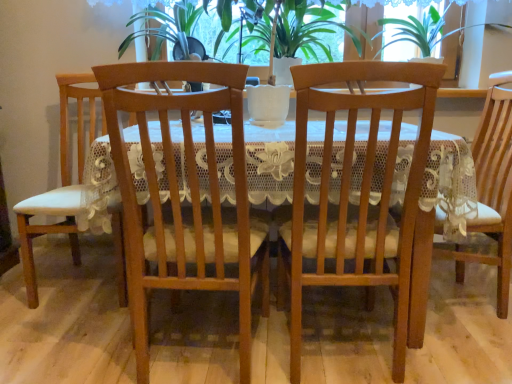
Question: Is white leather chair at left, the 4th chair in the right-to-left sequence, spatially inside wooden table at center, or outside of it?

Choices:
 (A) outside
 (B) inside

Answer: (A)

Question: Is white leather chair at left, the 4th chair in the right-to-left sequence, taller or shorter than wooden table at center?

Choices:
 (A) short
 (B) tall

Answer: (B)

Question: Which object is the farthest from the white leather chair at left, the 4th chair in the right-to-left sequence?

Choices:
 (A) transparent lace at upper center
 (B) wooden table at center
 (C) matte wood chair at center, the third chair from the left
 (D) matte wood chair at center, marked as the second chair in a left-to-right arrangement
 (E) green leafy plant at center

Answer: (A)

Question: Which of these objects is positioned closest to the wooden table at center?

Choices:
 (A) green leafy plant at center
 (B) white leather chair at left, the 4th chair in the right-to-left sequence
 (C) matte wood chair at center, which is the 4th chair in left-to-right order
 (D) transparent lace at upper center
 (E) matte wood chair at center, the second chair in the right-to-left sequence

Answer: (E)